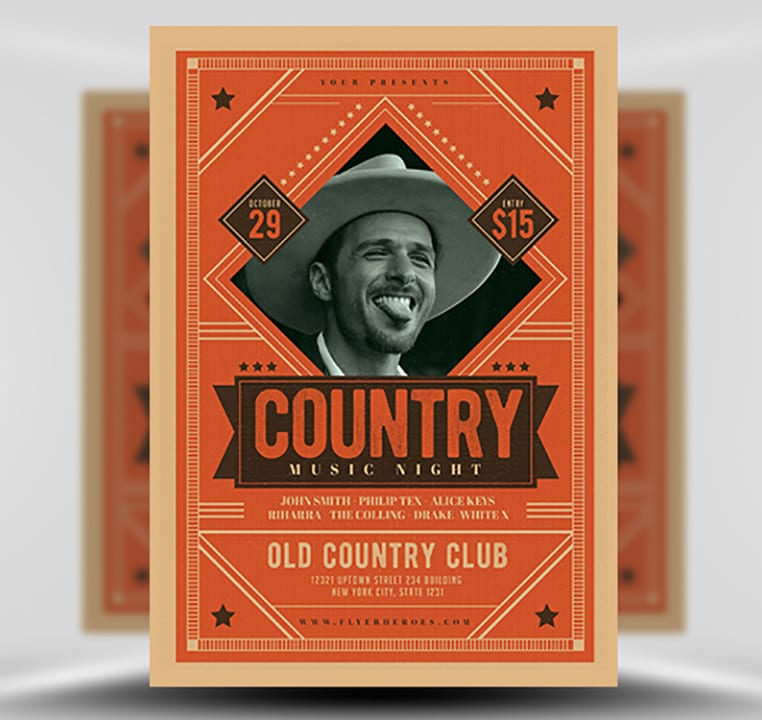
You are a GUI agent. You are given a task and a screenshot of the screen. Output one action in this format:
    pyautogui.click(x=<x>, y=<y>)
    Task: Click on the view of right side of poster behind main graphic poster
    This screenshot has height=720, width=762.
    Given the screenshot: What is the action you would take?
    pyautogui.click(x=125, y=430)